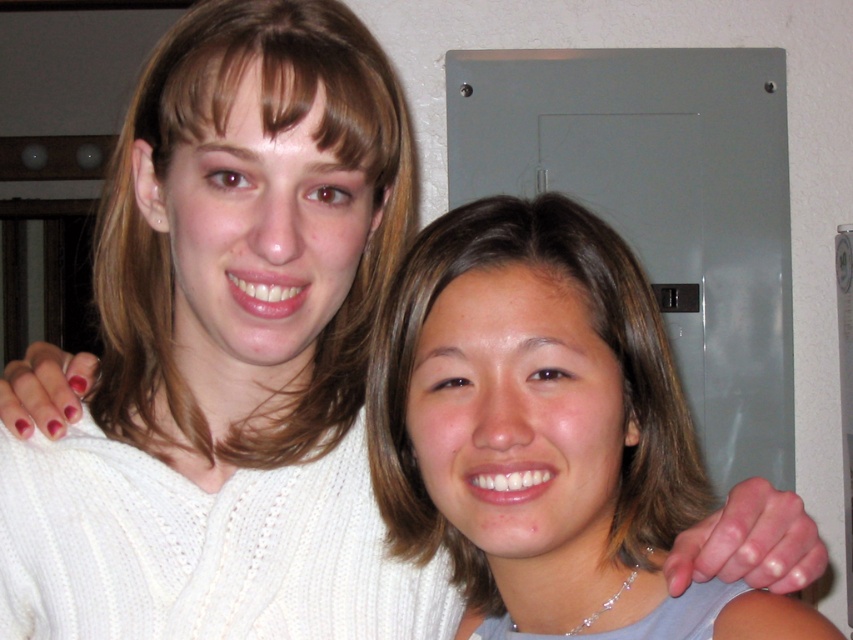
Who is more forward, (384, 403) or (181, 38)?

Point (384, 403) is more forward.

Is point (380, 392) positioned in front of point (202, 116)?

No, (380, 392) is further to viewer.

Is point (466, 435) farther from camera compared to point (247, 24)?

No, it is in front of (247, 24).

I want to click on smooth brown hair at center, so click(546, 433).